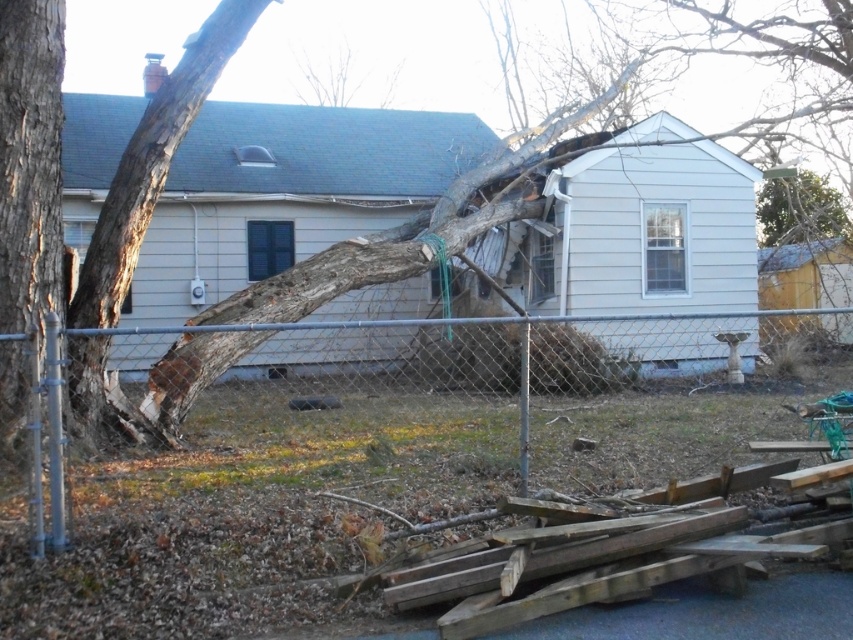
You are a drone operator trying to assess the damage from above. You see two points marked in the scene. Which point is closer to the camera? The points are point (549, 408) and point (30, 224).

Point (30, 224) is closer to the camera because the description states that point (549, 408) is further away than point (30, 224).